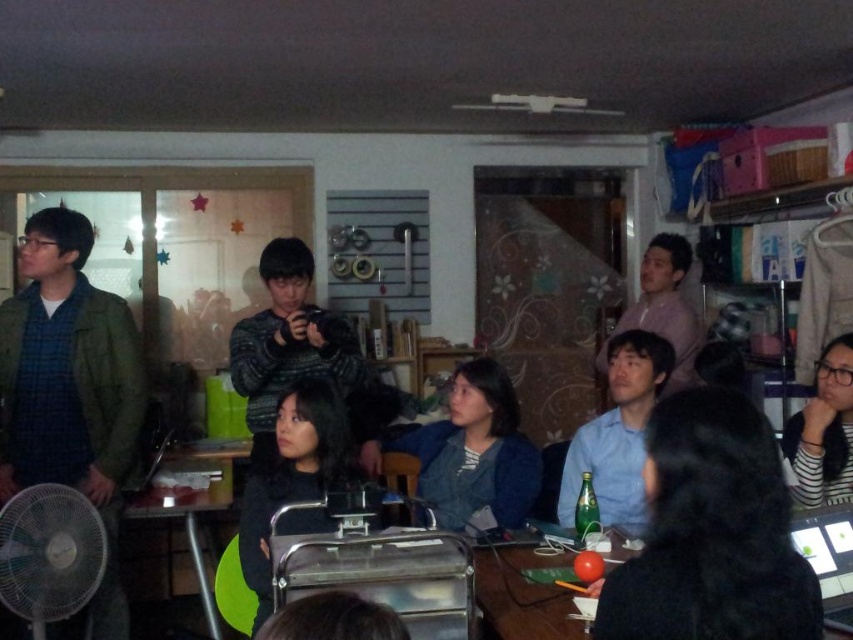
Based on the photo, you are a delivery person carrying a package that requires a 1.2 meter clearance to pass. You need to navigate between the black matte shirt at center and the black striped shirt at lower right. Can you safely move through the space between them with the package?

The distance between the black matte shirt at center and the black striped shirt at lower right is 1.14 meters, which is less than the required 1.2 meter clearance. Therefore, you cannot safely move through the space with the package.

You are standing in the room and want to turn on the black plastic fan at lower left. To reach it, you need to move past the black striped shirt at lower right. Is the fan positioned below the shirt, making it accessible without moving the shirt?

The black plastic fan at lower left is below the black striped shirt at lower right, so yes, you can reach the fan without moving the shirt as it is positioned beneath it.